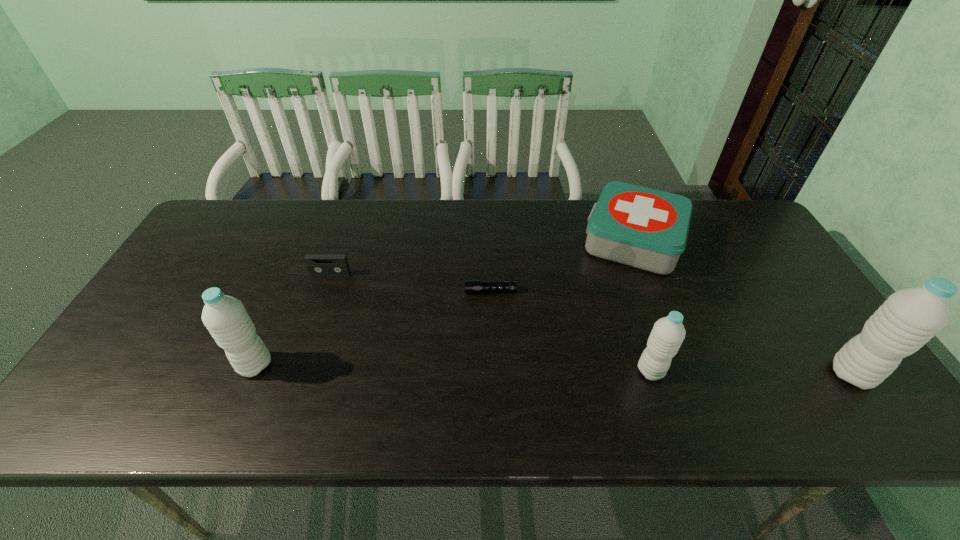
To make them evenly spaced by inserting another water_bottle among them, please locate a vacant spot for this new water_bottle. Please provide its 2D coordinates. Your answer should be formatted as a tuple, i.e. [(x, y)], where the tuple contains the x and y coordinates of a point satisfying the conditions above.

[(452, 368)]